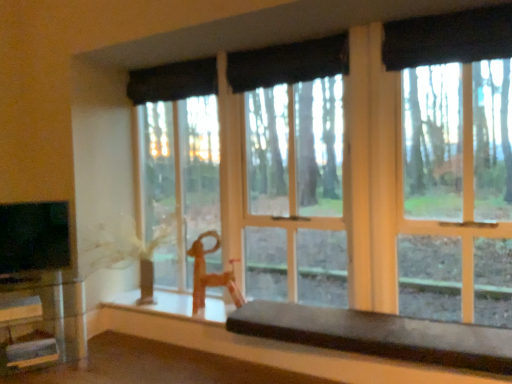
Question: Is the position of black fabric curtain at upper center, which is the second curtain in back-to-front order, more distant than that of black fabric curtain at upper center, the 4th curtain from the front?

Choices:
 (A) yes
 (B) no

Answer: (B)

Question: Is black fabric curtain at upper center, the third curtain positioned from the front, outside of black fabric curtain at upper center, the 4th curtain from the front?

Choices:
 (A) no
 (B) yes

Answer: (B)

Question: From the image's perspective, would you say black fabric curtain at upper center, the third curtain positioned from the front, is positioned over black fabric curtain at upper center, placed as the first curtain when sorted from back to front?

Choices:
 (A) no
 (B) yes

Answer: (A)

Question: Considering the relative sizes of black fabric curtain at upper center, which is the second curtain in back-to-front order, and black fabric curtain at upper center, the 4th curtain from the front, in the image provided, is black fabric curtain at upper center, which is the second curtain in back-to-front order, shorter than black fabric curtain at upper center, the 4th curtain from the front,?

Choices:
 (A) yes
 (B) no

Answer: (B)

Question: Is black fabric curtain at upper center, which is the second curtain in back-to-front order, far away from black fabric curtain at upper center, placed as the first curtain when sorted from back to front?

Choices:
 (A) yes
 (B) no

Answer: (B)

Question: Considering the relative positions of black fabric curtain at upper center, which is the second curtain in back-to-front order, and black fabric curtain at upper center, placed as the first curtain when sorted from back to front, in the image provided, is black fabric curtain at upper center, which is the second curtain in back-to-front order, to the left of black fabric curtain at upper center, placed as the first curtain when sorted from back to front, from the viewer's perspective?

Choices:
 (A) yes
 (B) no

Answer: (B)

Question: Is black fabric curtain at upper center, which is the second curtain in back-to-front order, thinner than black fabric curtain at upper center, which is the first curtain from front to back?

Choices:
 (A) yes
 (B) no

Answer: (A)

Question: Does black fabric curtain at upper center, the third curtain positioned from the front, appear on the left side of black fabric curtain at upper center, the fourth curtain positioned from the back?

Choices:
 (A) yes
 (B) no

Answer: (B)

Question: Is black fabric curtain at upper center, which is the second curtain in back-to-front order, bigger than black fabric curtain at upper center, the fourth curtain positioned from the back?

Choices:
 (A) yes
 (B) no

Answer: (B)

Question: From the image's perspective, is black fabric curtain at upper center, which is the second curtain in back-to-front order, below black fabric curtain at upper center, which is the first curtain from front to back?

Choices:
 (A) no
 (B) yes

Answer: (B)

Question: Does black fabric curtain at upper center, which is the second curtain in back-to-front order, turn towards black fabric curtain at upper center, which is the first curtain from front to back?

Choices:
 (A) yes
 (B) no

Answer: (A)

Question: Can you confirm if black fabric curtain at upper center, which is the second curtain in back-to-front order, is smaller than black fabric curtain at upper center, which is the first curtain from front to back?

Choices:
 (A) no
 (B) yes

Answer: (B)

Question: Is smooth dark brown bench at lower center, arranged as the 2th table when viewed from the left, oriented towards black fabric curtain at upper center, placed as the first curtain when sorted from back to front?

Choices:
 (A) yes
 (B) no

Answer: (B)